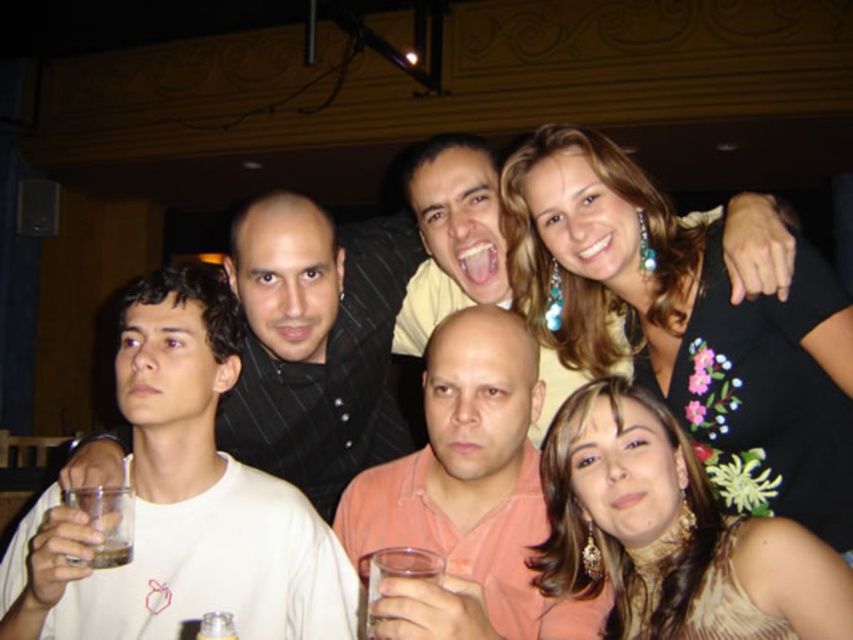
You are a photographer at a social event and notice two dresses in the scene. The black floral dress at upper right and the brown textured dress at center. Which dress is positioned higher up in the image?

The black floral dress at upper right is taller than the brown textured dress at center, so it is positioned higher up in the image.